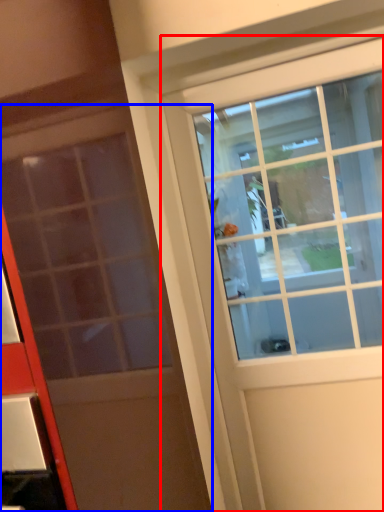
Question: Which object appears farthest to the camera in this image, door (highlighted by a red box) or door (highlighted by a blue box)?

Choices:
 (A) door
 (B) door

Answer: (A)